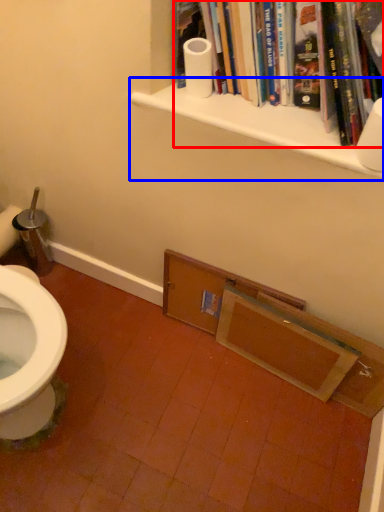
Question: Which point is closer to the camera, book (highlighted by a red box) or shelf (highlighted by a blue box)?

Choices:
 (A) book
 (B) shelf

Answer: (A)